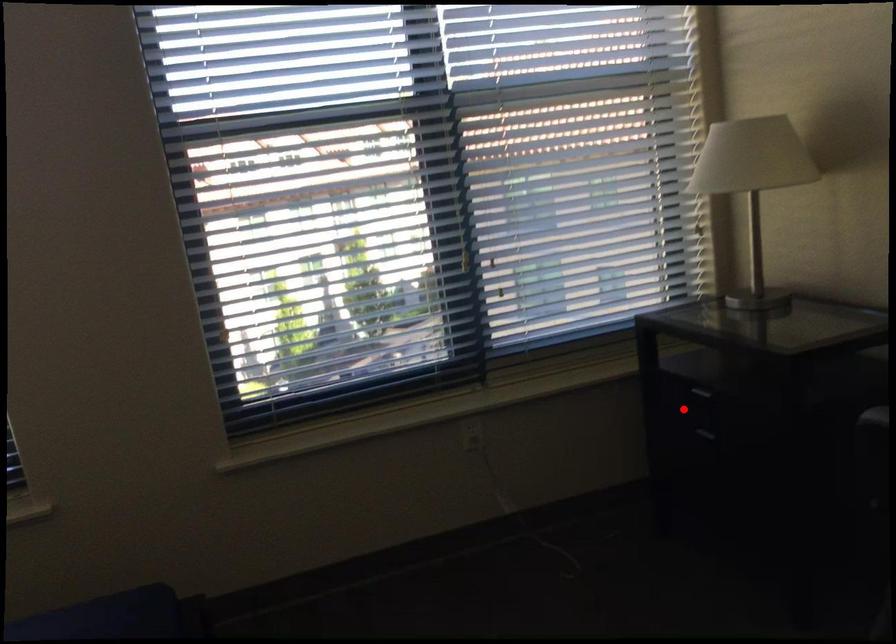
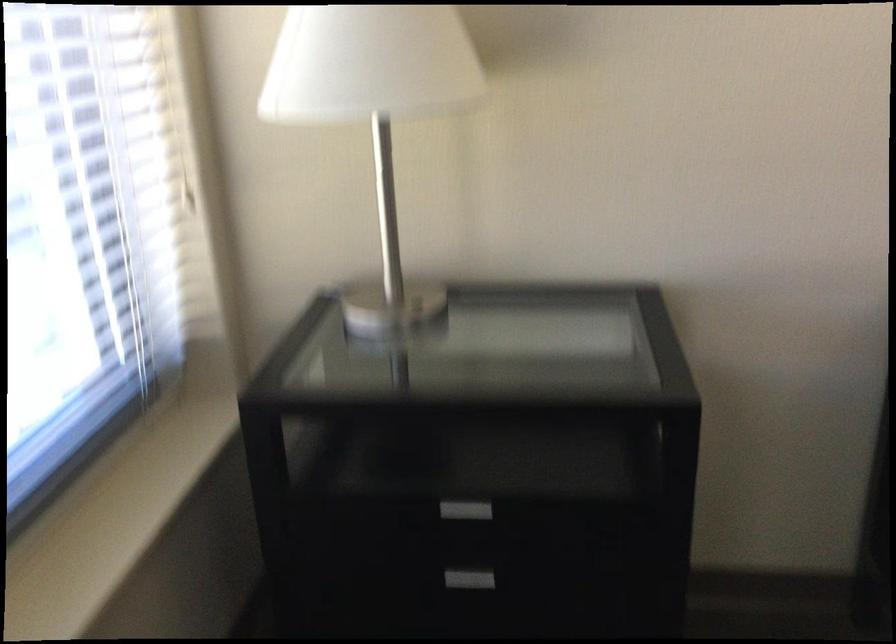
Question: A red point is marked in image1. In image2, is the corresponding 3D point closer to the camera or farther? Reply with the corresponding letter.

Choices:
 (A) The corresponding 3D point is closer.
 (B) The corresponding 3D point is farther.

Answer: (A)